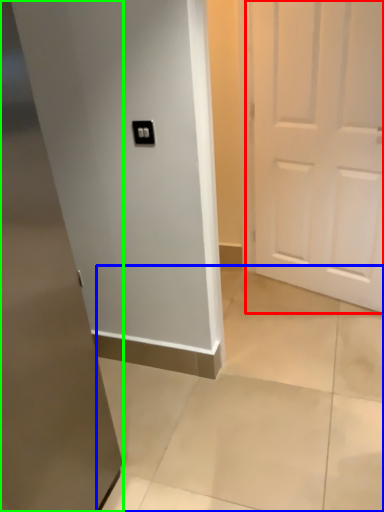
Question: Which object is the closest to the door (highlighted by a red box)? Choose among these: concrete (highlighted by a blue box) or door (highlighted by a green box).

Choices:
 (A) concrete
 (B) door

Answer: (A)